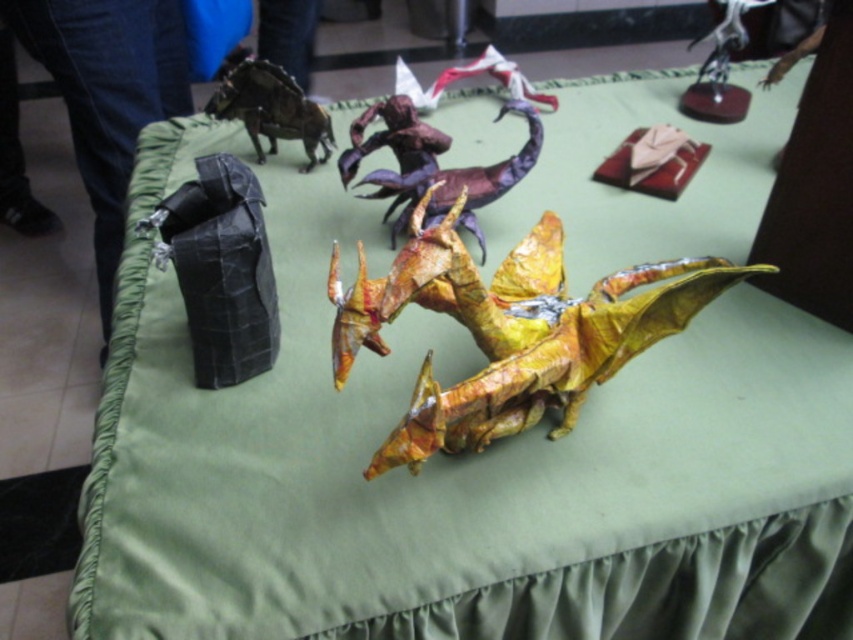
Question: Estimate the real-world distances between objects in this image. Which object is closer to the purple matte origami dragon at center?

Choices:
 (A) shiny metallic dinosaur at upper left
 (B) shiny metallic dragon at center

Answer: (B)

Question: Which point is closer to the camera?

Choices:
 (A) (512, 179)
 (B) (235, 100)
 (C) (636, 280)

Answer: (C)

Question: Can you confirm if shiny metallic dragon at center is positioned below shiny metallic dinosaur at upper left?

Choices:
 (A) no
 (B) yes

Answer: (B)

Question: Does purple matte origami dragon at center appear over shiny metallic dinosaur at upper left?

Choices:
 (A) no
 (B) yes

Answer: (A)

Question: Can you confirm if purple matte origami dragon at center is positioned to the right of shiny metallic dinosaur at upper left?

Choices:
 (A) yes
 (B) no

Answer: (A)

Question: Which object appears farthest from the camera in this image?

Choices:
 (A) shiny metallic dinosaur at upper left
 (B) purple matte origami dragon at center
 (C) shiny metallic dragon at center

Answer: (A)